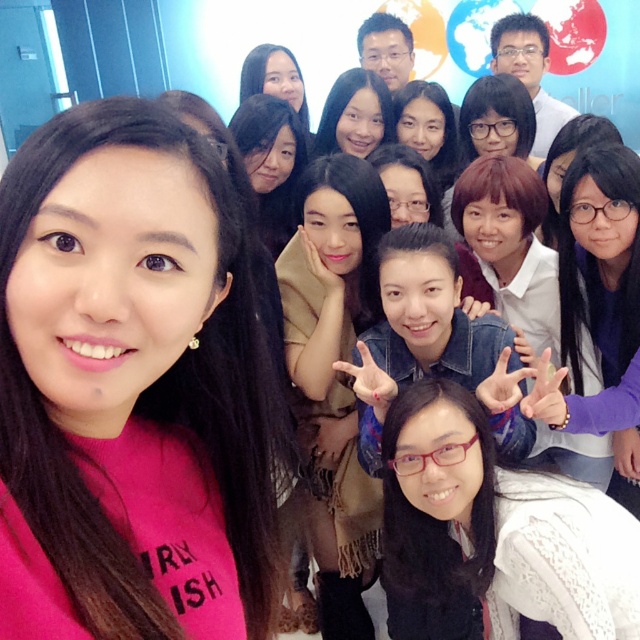
From the picture: You are organizing a photo shoot and need to position two props. The pink fabric at center and the purple matte sweater at lower right are already placed. From the photographer standing at the back of the room, which prop is closer to the left side of the frame?

The pink fabric at center is to the left of the purple matte sweater at lower right, so from the photographer standing at the back, the pink fabric at center is closer to the left side of the frame.

You are a photographer setting up for a group photo. You notice the clear plastic glasses at center and the matte brown hair at center in the scene. Which object is positioned lower in the frame?

The clear plastic glasses at center is positioned lower than the matte brown hair at center in the frame.